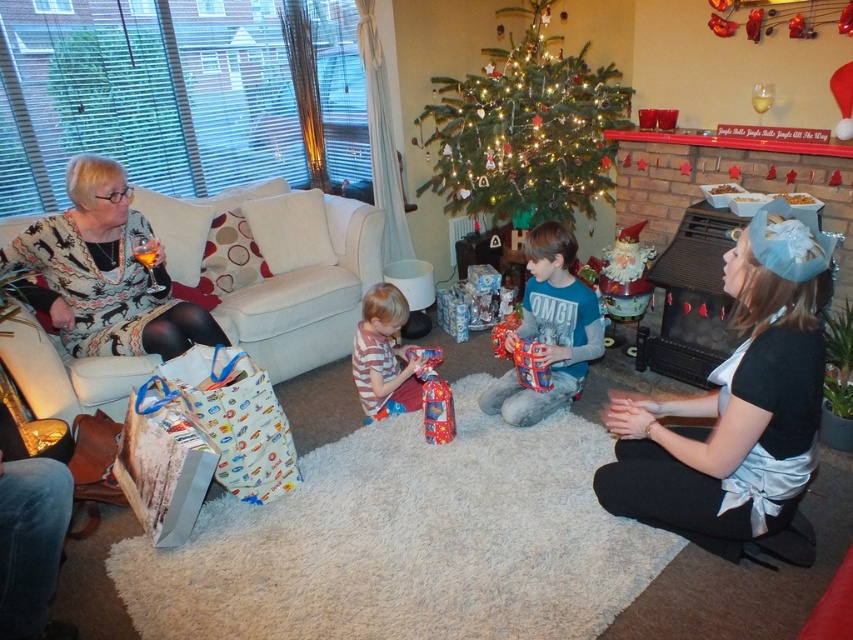
Question: Which of the following is the closest to the observer?

Choices:
 (A) striped fabric shirt at center
 (B) silky silver dress at lower right

Answer: (B)

Question: In this image, where is silky silver dress at lower right located relative to patterned sweater at left?

Choices:
 (A) left
 (B) right

Answer: (B)

Question: Can you confirm if silky silver dress at lower right is positioned below green matte christmas tree at center?

Choices:
 (A) no
 (B) yes

Answer: (B)

Question: Based on their relative distances, which object is farther from the blue cotton shirt at center?

Choices:
 (A) silky silver dress at lower right
 (B) striped fabric shirt at center
 (C) green matte christmas tree at center

Answer: (C)

Question: Does silky silver dress at lower right have a larger size compared to patterned sweater at left?

Choices:
 (A) yes
 (B) no

Answer: (A)

Question: Estimate the real-world distances between objects in this image. Which object is closer to the patterned sweater at left?

Choices:
 (A) green matte christmas tree at center
 (B) striped fabric shirt at center
 (C) blue cotton shirt at center

Answer: (B)